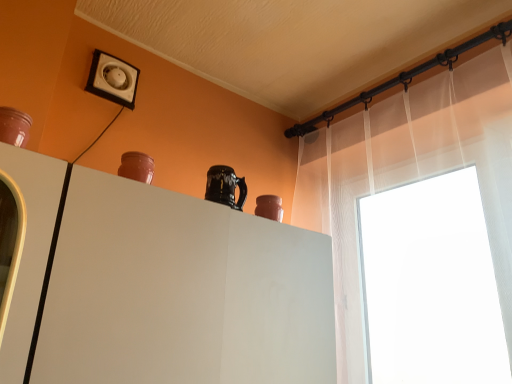
Question: From a real-world perspective, is matte clay vase at upper right, which ranks as the first vase in bottom-to-top order, below white plastic electric outlet at upper left?

Choices:
 (A) no
 (B) yes

Answer: (B)

Question: From the image's perspective, is matte clay vase at upper right, acting as the 2th vase starting from the front, located beneath white plastic electric outlet at upper left?

Choices:
 (A) yes
 (B) no

Answer: (A)

Question: Can you confirm if matte clay vase at upper right, acting as the 2th vase starting from the front, is positioned to the right of white plastic electric outlet at upper left?

Choices:
 (A) yes
 (B) no

Answer: (A)

Question: Is matte clay vase at upper right, acting as the 2th vase starting from the front, behind white plastic electric outlet at upper left?

Choices:
 (A) yes
 (B) no

Answer: (B)

Question: Does matte clay vase at upper right, which is counted as the 1th vase, starting from the right, have a lesser height compared to white plastic electric outlet at upper left?

Choices:
 (A) yes
 (B) no

Answer: (A)

Question: Is white matte cabinet at center taller or shorter than sheer white curtain at upper right?

Choices:
 (A) short
 (B) tall

Answer: (A)

Question: Looking at their shapes, would you say white matte cabinet at center is wider or thinner than sheer white curtain at upper right?

Choices:
 (A) wide
 (B) thin

Answer: (B)

Question: Is point (168, 279) positioned closer to the camera than point (336, 124)?

Choices:
 (A) farther
 (B) closer

Answer: (B)

Question: From a real-world perspective, relative to sheer white curtain at upper right, is white matte cabinet at center vertically above or below?

Choices:
 (A) above
 (B) below

Answer: (B)

Question: From a real-world perspective, is sheer white curtain at upper right positioned above or below white matte cabinet at center?

Choices:
 (A) below
 (B) above

Answer: (B)

Question: Considering the positions of sheer white curtain at upper right and white matte cabinet at center in the image, is sheer white curtain at upper right wider or thinner than white matte cabinet at center?

Choices:
 (A) wide
 (B) thin

Answer: (A)

Question: From their relative heights in the image, would you say sheer white curtain at upper right is taller or shorter than white matte cabinet at center?

Choices:
 (A) tall
 (B) short

Answer: (A)

Question: From the image's perspective, relative to white matte cabinet at center, is sheer white curtain at upper right above or below?

Choices:
 (A) above
 (B) below

Answer: (A)

Question: Considering their positions, is matte brown vase at upper left, which is counted as the second vase, starting from the right, located in front of or behind sheer white curtain at upper right?

Choices:
 (A) behind
 (B) front

Answer: (A)

Question: In terms of width, does matte brown vase at upper left, the second vase positioned from the back, look wider or thinner when compared to sheer white curtain at upper right?

Choices:
 (A) thin
 (B) wide

Answer: (A)